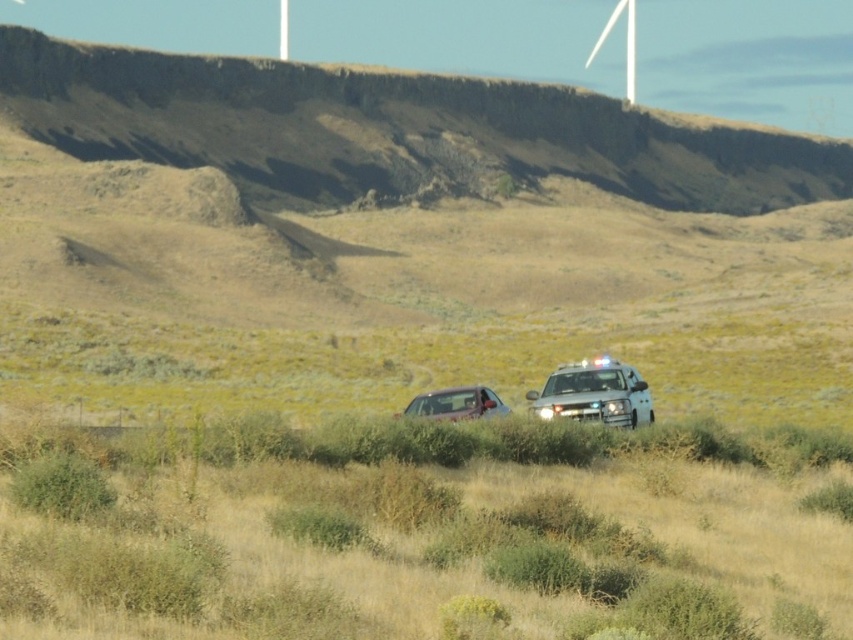
Does white glossy police car at lower right have a lesser width compared to metallic silver car at center?

No.

Which is more to the left, white glossy police car at lower right or metallic silver car at center?

Positioned to the left is metallic silver car at center.

Identify the location of white glossy police car at lower right. 595,394.

The width and height of the screenshot is (853, 640). Find the location of `white glossy police car at lower right`. white glossy police car at lower right is located at coordinates (595, 394).

Is dry grass at center bigger than metallic silver car at center?

Indeed, dry grass at center has a larger size compared to metallic silver car at center.

Which is in front, point (573, 500) or point (474, 417)?

Positioned in front is point (573, 500).

The height and width of the screenshot is (640, 853). I want to click on dry grass at center, so click(422, 531).

Does dry grass at center have a larger size compared to white glossy police car at lower right?

Indeed, dry grass at center has a larger size compared to white glossy police car at lower right.

Which is behind, point (339, 474) or point (596, 419)?

The point (596, 419) is behind.

This screenshot has width=853, height=640. Find the location of `dry grass at center`. dry grass at center is located at coordinates (422, 531).